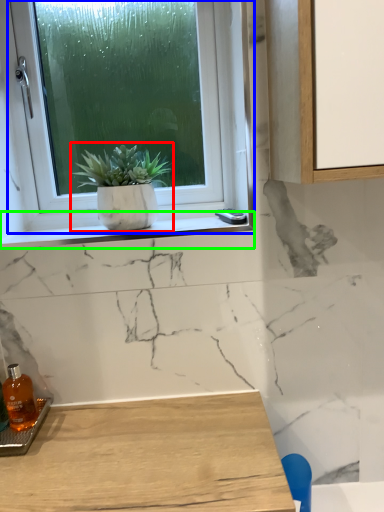
Question: Based on their relative distances, which object is farther from houseplant (highlighted by a red box)? Choose from window (highlighted by a blue box) and window sill (highlighted by a green box).

Choices:
 (A) window
 (B) window sill

Answer: (A)